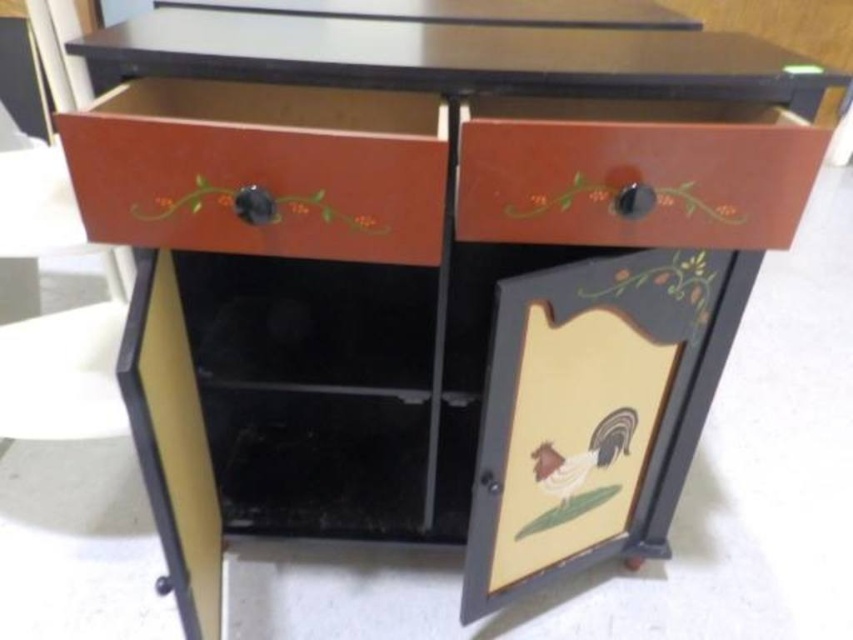
Who is taller, matte wood drawer at upper left or matte brown drawer at upper right?

matte wood drawer at upper left

Can you confirm if matte wood drawer at upper left is positioned to the left of matte brown drawer at upper right?

Indeed, matte wood drawer at upper left is positioned on the left side of matte brown drawer at upper right.

Does point (209, 156) come in front of point (540, 124)?

No, it is behind (540, 124).

At what (x,y) coordinates should I click in order to perform the action: click on matte wood drawer at upper left. Please return your answer as a coordinate pair (x, y). Looking at the image, I should click on (260, 168).